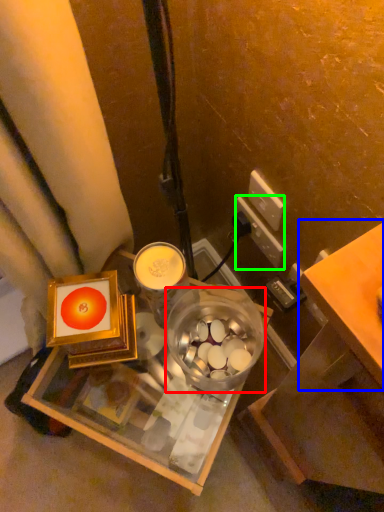
Question: Which object is the farthest from glass bowl (highlighted by a red box)? Choose among these: table (highlighted by a blue box) or power outlet (highlighted by a green box).

Choices:
 (A) table
 (B) power outlet

Answer: (A)